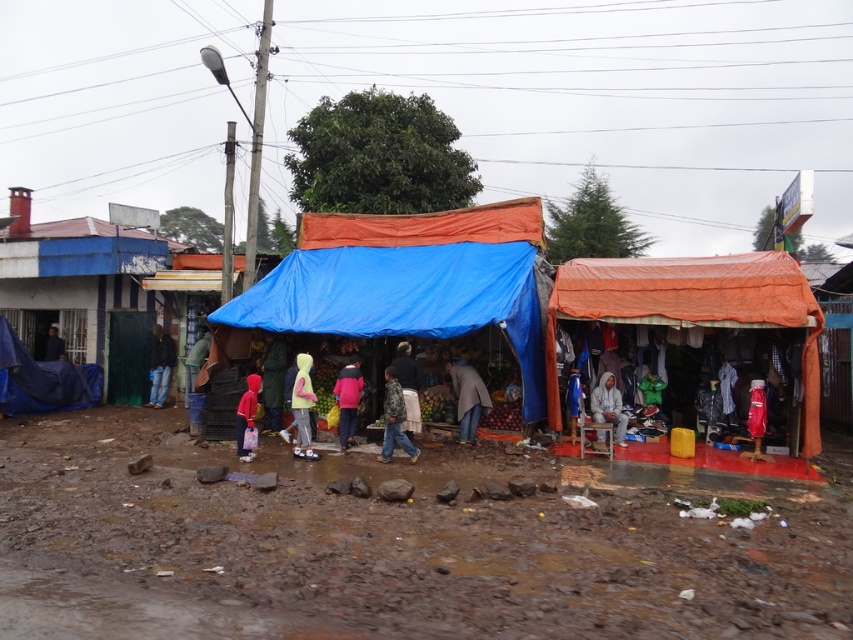
Consider the image. You are a customer at the market and want to buy some fresh produce. You see the blue tarpaulin tent at center and the matte red jacket at center. Which direction should you walk to reach the produce stall?

The blue tarpaulin tent at center is to the right of the matte red jacket at center. Since the blue tarpaulin tent at center sells fresh produce, you should walk to the right of the matte red jacket at center to reach the produce stall.

You are a customer at the market and want to know which jacket is shorter. You see a yellow matte jacket at center and a green matte jacket at center. Which one is shorter?

The yellow matte jacket at center is shorter than the green matte jacket at center.